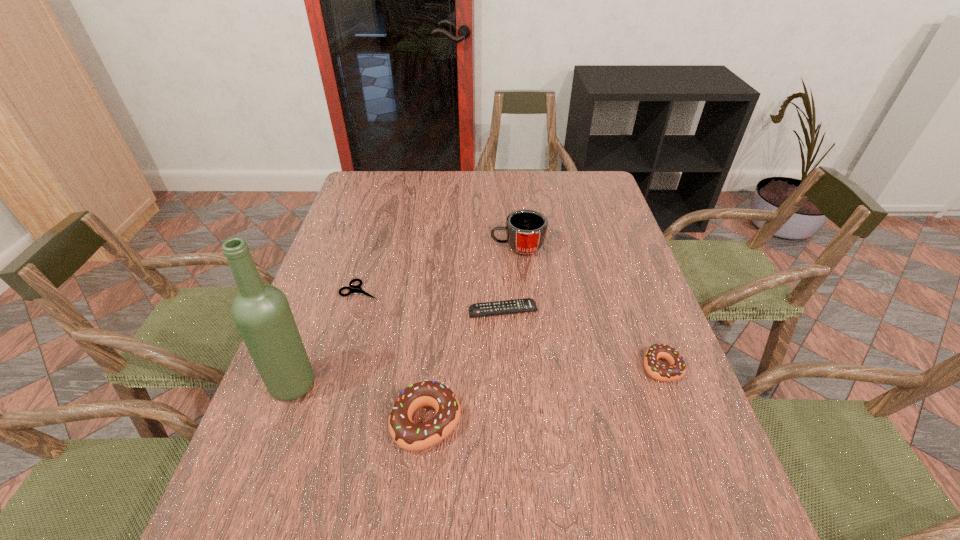
Find the location of a particular element. This screenshot has height=540, width=960. the fifth tallest object is located at coordinates (x=528, y=304).

Locate an element on the screen. free spot located on the right of the left doughnut is located at coordinates (553, 422).

The height and width of the screenshot is (540, 960). Identify the location of blank space located on the left of the shorter doughnut. (499, 367).

Locate an element on the screen. This screenshot has width=960, height=540. blank area located on the side of the second tallest object with the handle is located at coordinates (372, 247).

This screenshot has height=540, width=960. I want to click on vacant space situated 0.070m on the side of the second tallest object with the handle, so click(x=468, y=247).

What are the coordinates of `free space located 0.120m on the side of the second tallest object with the handle` in the screenshot? It's located at (451, 247).

Identify the location of free space located 0.210m on the back of the second farthest object. This screenshot has width=960, height=540. (376, 235).

Where is `blank space located on the right of the tallest object`? The image size is (960, 540). blank space located on the right of the tallest object is located at coordinates (428, 384).

This screenshot has height=540, width=960. What are the coordinates of `free region located on the front of the second shortest object` in the screenshot? It's located at (512, 471).

Find the location of a particular element. The image size is (960, 540). object situated at the near edge is located at coordinates (408, 435).